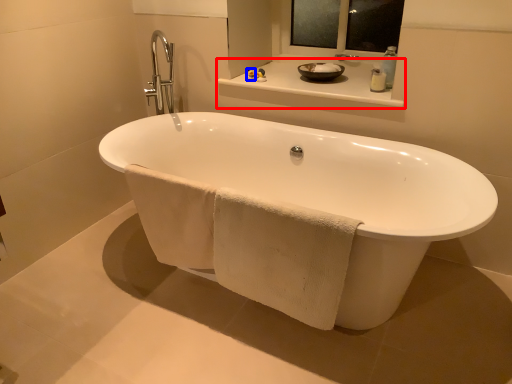
Question: Among these objects, which one is nearest to the camera, counter top (highlighted by a red box) or toiletry (highlighted by a blue box)?

Choices:
 (A) counter top
 (B) toiletry

Answer: (A)